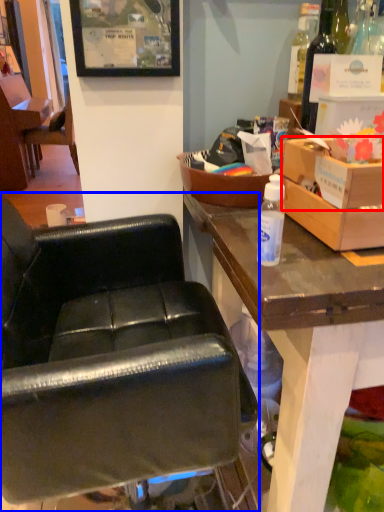
Question: Which object is closer to the camera taking this photo, box (highlighted by a red box) or chair (highlighted by a blue box)?

Choices:
 (A) box
 (B) chair

Answer: (B)